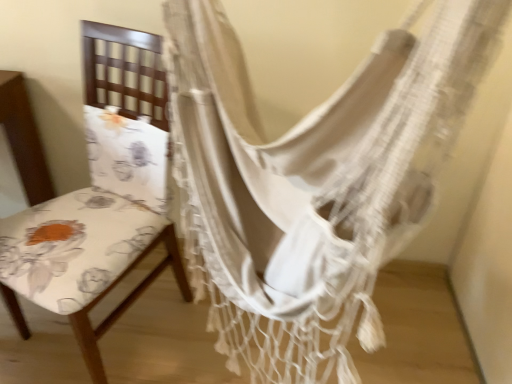
Describe the element at coordinates (312, 183) in the screenshot. I see `white woven hammock at center` at that location.

I want to click on white woven hammock at center, so click(312, 183).

At what (x,y) coordinates should I click in order to perform the action: click on floral fabric chair at left. Please return your answer as a coordinate pair (x, y). Looking at the image, I should click on (24, 138).

What do you see at coordinates (24, 138) in the screenshot? I see `floral fabric chair at left` at bounding box center [24, 138].

Measure the distance between floral fabric chair at left and camera.

A distance of 3.53 feet exists between floral fabric chair at left and camera.

The width and height of the screenshot is (512, 384). Find the location of `white woven hammock at center`. white woven hammock at center is located at coordinates (312, 183).

Considering the positions of objects white woven hammock at center and floral fabric chair at left in the image provided, who is more to the left, white woven hammock at center or floral fabric chair at left?

floral fabric chair at left is more to the left.

In the image, is white woven hammock at center positioned in front of or behind floral fabric chair at left?

Visually, white woven hammock at center is located in front of floral fabric chair at left.

Is point (352, 206) closer to viewer compared to point (95, 25)?

Yes, point (352, 206) is closer to viewer.

From the image's perspective, does white woven hammock at center appear lower than floral fabric chair at left?

Incorrect, from the image's perspective, white woven hammock at center is higher than floral fabric chair at left.

From a real-world perspective, is white woven hammock at center on top of floral fabric chair at left?

Correct, in the physical world, white woven hammock at center is higher than floral fabric chair at left.

Considering the sizes of objects white woven hammock at center and floral fabric chair at left in the image provided, who is wider, white woven hammock at center or floral fabric chair at left?

Wider between the two is floral fabric chair at left.

From their relative heights in the image, would you say white woven hammock at center is taller or shorter than floral fabric chair at left?

Considering their sizes, white woven hammock at center has less height than floral fabric chair at left.

Considering the sizes of objects white woven hammock at center and floral fabric chair at left in the image provided, who is smaller, white woven hammock at center or floral fabric chair at left?

Smaller between the two is floral fabric chair at left.

Is white woven hammock at center spatially inside floral fabric chair at left, or outside of it?

white woven hammock at center is outside floral fabric chair at left.

Is there a large distance between white woven hammock at center and floral fabric chair at left?

No, white woven hammock at center is not far away from floral fabric chair at left.

Is white woven hammock at center facing towards floral fabric chair at left?

Yes, white woven hammock at center is oriented towards floral fabric chair at left.

How different are the orientations of white woven hammock at center and floral fabric chair at left in degrees?

The angle between the facing direction of white woven hammock at center and the facing direction of floral fabric chair at left is 26.6 degrees.

This screenshot has height=384, width=512. In order to click on curtain above the floral fabric chair at left (from a real-world perspective) in this screenshot , I will do `click(312, 183)`.

Is floral fabric chair at left at the right side of white woven hammock at center?

No.

Which is behind, floral fabric chair at left or white woven hammock at center?

Positioned behind is floral fabric chair at left.

Considering the positions of point (120, 279) and point (226, 173), is point (120, 279) closer or farther from the camera than point (226, 173)?

Point (120, 279).

Based on the photo, from the image's perspective, is floral fabric chair at left on white woven hammock at center?

No, from the image's perspective, floral fabric chair at left is not above white woven hammock at center.

From a real-world perspective, is floral fabric chair at left positioned over white woven hammock at center based on gravity?

No, from a real-world perspective, floral fabric chair at left is not over white woven hammock at center

Between floral fabric chair at left and white woven hammock at center, which one has larger width?

floral fabric chair at left.

Considering the sizes of objects floral fabric chair at left and white woven hammock at center in the image provided, who is shorter, floral fabric chair at left or white woven hammock at center?

white woven hammock at center is shorter.

Considering the sizes of objects floral fabric chair at left and white woven hammock at center in the image provided, who is bigger, floral fabric chair at left or white woven hammock at center?

Bigger between the two is white woven hammock at center.

Is white woven hammock at center surrounded by floral fabric chair at left?

No, white woven hammock at center is located outside of floral fabric chair at left.

Is floral fabric chair at left not close to white woven hammock at center?

That's not correct — floral fabric chair at left is a little close to white woven hammock at center.

Is floral fabric chair at left turned away from white woven hammock at center?

Correct, floral fabric chair at left is looking away from white woven hammock at center.

In the scene shown: What's the angular difference between floral fabric chair at left and white woven hammock at center's facing directions?

26.6 degrees separate the facing orientations of floral fabric chair at left and white woven hammock at center.

The image size is (512, 384). I want to click on chair behind the white woven hammock at center, so click(x=24, y=138).

This screenshot has height=384, width=512. I want to click on chair located below the white woven hammock at center (from the image's perspective), so click(24, 138).

Locate an element on the screen. chair below the white woven hammock at center (from a real-world perspective) is located at coordinates (24, 138).